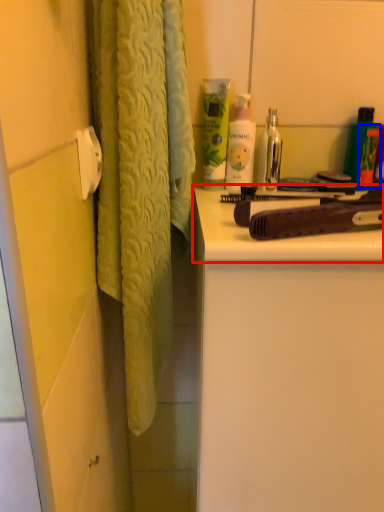
Question: Among these objects, which one is farthest to the camera, counter top (highlighted by a red box) or toiletry (highlighted by a blue box)?

Choices:
 (A) counter top
 (B) toiletry

Answer: (B)